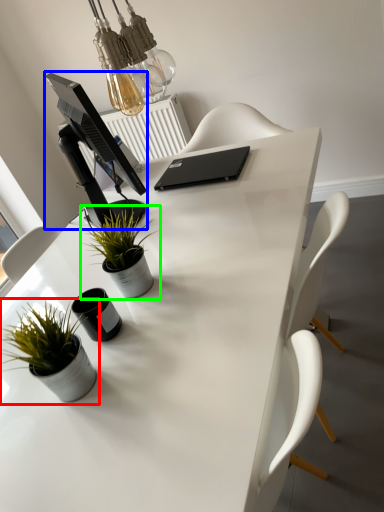
Question: Based on their relative distances, which object is nearer to houseplant (highlighted by a red box)? Choose from computer monitor (highlighted by a blue box) and houseplant (highlighted by a green box).

Choices:
 (A) computer monitor
 (B) houseplant

Answer: (B)